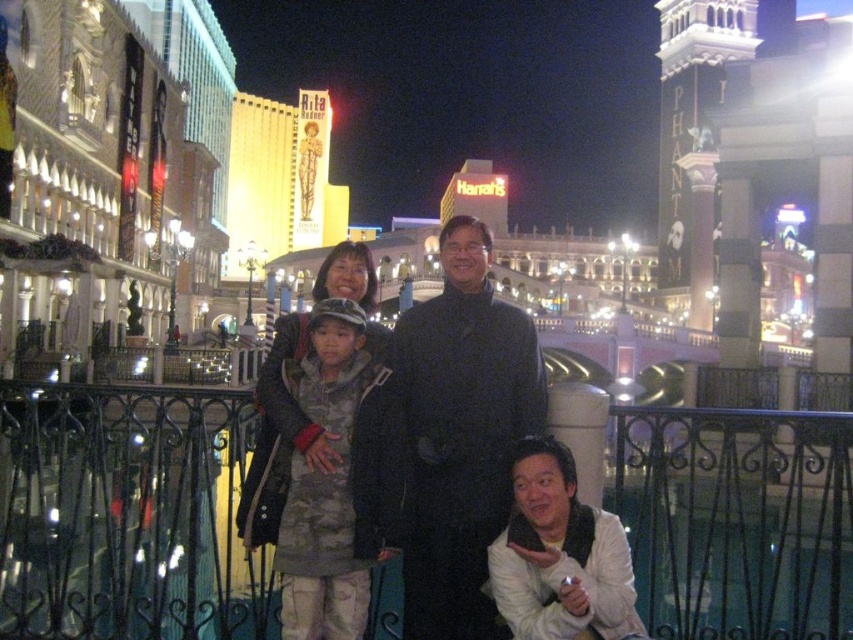
Question: Does camouflage jacket at center have a smaller size compared to camouflage fabric jacket at center?

Choices:
 (A) yes
 (B) no

Answer: (B)

Question: Based on their relative distances, which object is farther from the white matte jacket at lower right?

Choices:
 (A) camouflage fabric jacket at center
 (B) black matte suit at center

Answer: (A)

Question: Which point is farther to the camera?

Choices:
 (A) (306, 332)
 (B) (454, 611)
 (C) (592, 632)

Answer: (A)

Question: Estimate the real-world distances between objects in this image. Which object is farther from the camouflage jacket at center?

Choices:
 (A) white matte jacket at lower right
 (B) camouflage fabric jacket at center
 (C) black matte suit at center

Answer: (A)

Question: Observing the image, what is the correct spatial positioning of black matte suit at center in reference to camouflage fabric jacket at center?

Choices:
 (A) below
 (B) above

Answer: (B)

Question: From the image, what is the correct spatial relationship of black matte suit at center in relation to camouflage fabric jacket at center?

Choices:
 (A) left
 (B) right

Answer: (B)